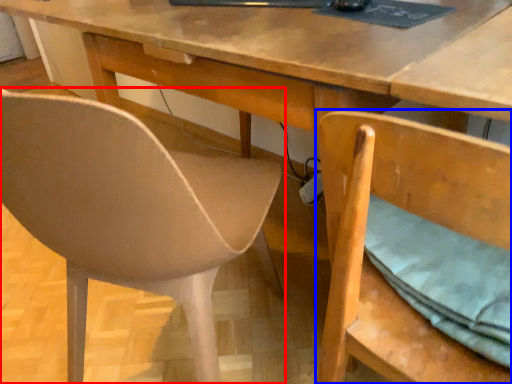
Question: Which point is closer to the camera, chair (highlighted by a red box) or chair (highlighted by a blue box)?

Choices:
 (A) chair
 (B) chair

Answer: (A)